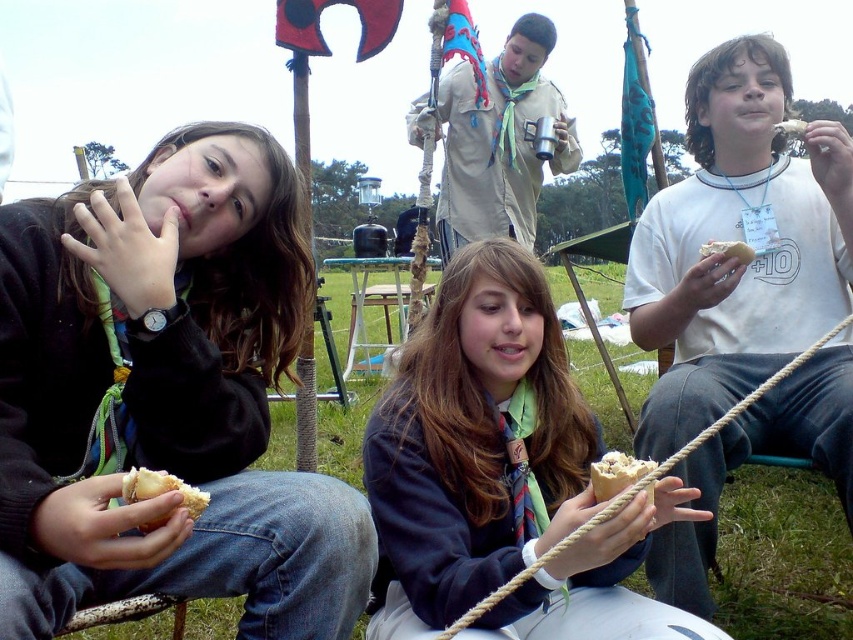
Question: Does matte black sweater at left appear on the left side of white bread at right?

Choices:
 (A) yes
 (B) no

Answer: (A)

Question: Which object is the farthest from the white bread at lower center?

Choices:
 (A) dark blue uniform at center
 (B) white bread at upper center
 (C) white bread at right

Answer: (B)

Question: Is matte black sweater at left to the right of white bread at lower center from the viewer's perspective?

Choices:
 (A) no
 (B) yes

Answer: (A)

Question: Which point is closer to the camera taking this photo?

Choices:
 (A) (738, 244)
 (B) (257, 250)

Answer: (B)

Question: Which object is farther from the camera taking this photo?

Choices:
 (A) white bread at upper center
 (B) brown crumbly bread at lower left

Answer: (A)

Question: Can you confirm if matte black sweater at left is smaller than dark blue uniform at center?

Choices:
 (A) yes
 (B) no

Answer: (B)